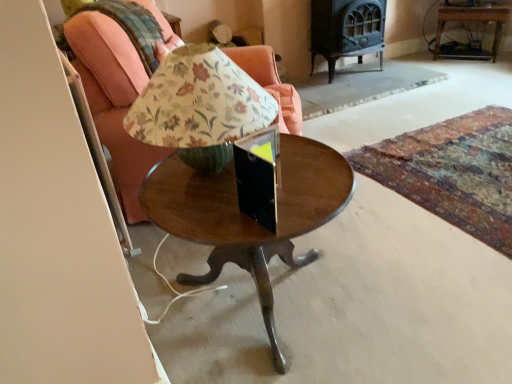
The width and height of the screenshot is (512, 384). Identify the location of free spot below wooden round table at center (from a real-world perspective). (275, 307).